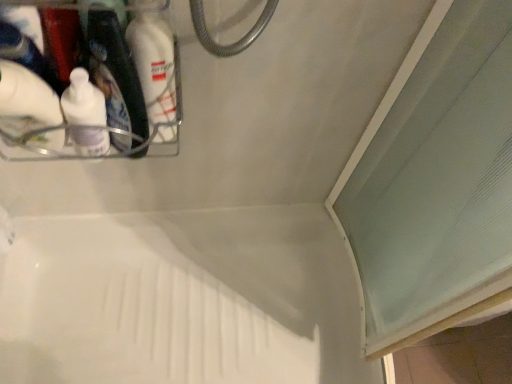
Question: Is white matte bottle at upper left with white matte bottle at upper left?

Choices:
 (A) yes
 (B) no

Answer: (B)

Question: Is white matte bottle at upper left aimed at white matte bottle at upper left?

Choices:
 (A) no
 (B) yes

Answer: (A)

Question: Does white matte bottle at upper left have a lesser width compared to white matte bottle at upper left?

Choices:
 (A) yes
 (B) no

Answer: (A)

Question: Is white matte bottle at upper left located outside white matte bottle at upper left?

Choices:
 (A) no
 (B) yes

Answer: (B)

Question: Considering the relative positions of white matte bottle at upper left and white matte bottle at upper left in the image provided, is white matte bottle at upper left to the left of white matte bottle at upper left from the viewer's perspective?

Choices:
 (A) yes
 (B) no

Answer: (A)

Question: From the image's perspective, is white matte bottle at upper left located beneath white matte bottle at upper left?

Choices:
 (A) yes
 (B) no

Answer: (A)

Question: Does white plastic bath at center have a greater width compared to white matte bottle at upper left?

Choices:
 (A) yes
 (B) no

Answer: (A)

Question: Can you confirm if white plastic bath at center is shorter than white matte bottle at upper left?

Choices:
 (A) no
 (B) yes

Answer: (A)

Question: From a real-world perspective, is white plastic bath at center located beneath white matte bottle at upper left?

Choices:
 (A) no
 (B) yes

Answer: (B)

Question: Is white plastic bath at center positioned before white matte bottle at upper left?

Choices:
 (A) no
 (B) yes

Answer: (A)

Question: Would you say white plastic bath at center is outside white matte bottle at upper left?

Choices:
 (A) no
 (B) yes

Answer: (B)

Question: Is white matte bottle at upper left at the back of white plastic bath at center?

Choices:
 (A) yes
 (B) no

Answer: (B)

Question: Considering the relative sizes of white plastic bath at center and white matte bottle at upper left in the image provided, is white plastic bath at center taller than white matte bottle at upper left?

Choices:
 (A) yes
 (B) no

Answer: (A)